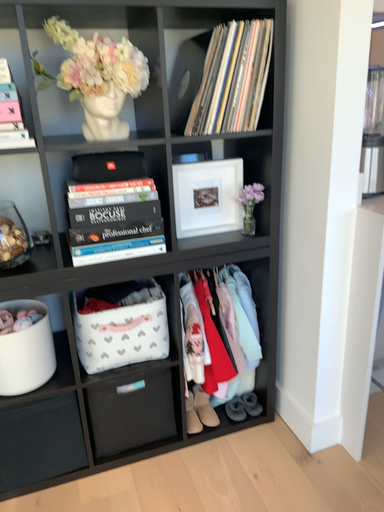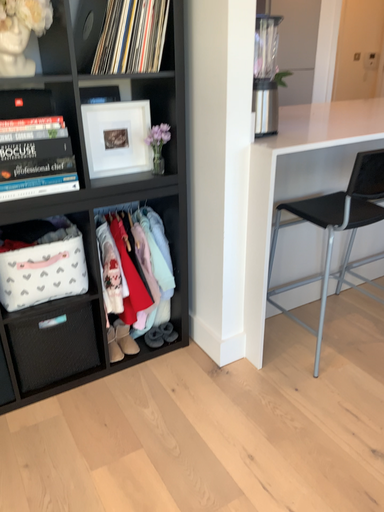
Question: How did the camera likely rotate when shooting the video?

Choices:
 (A) rotated right
 (B) rotated left

Answer: (A)